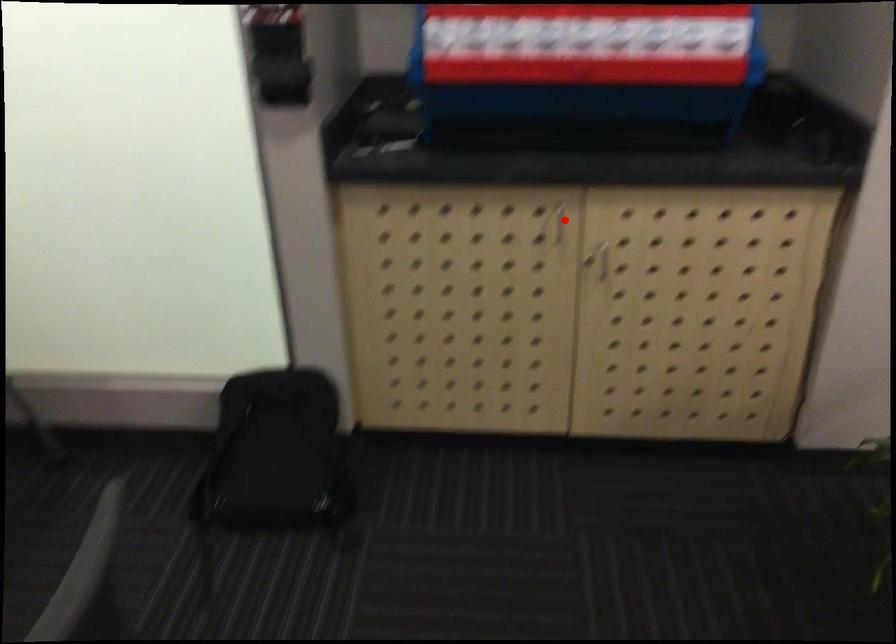
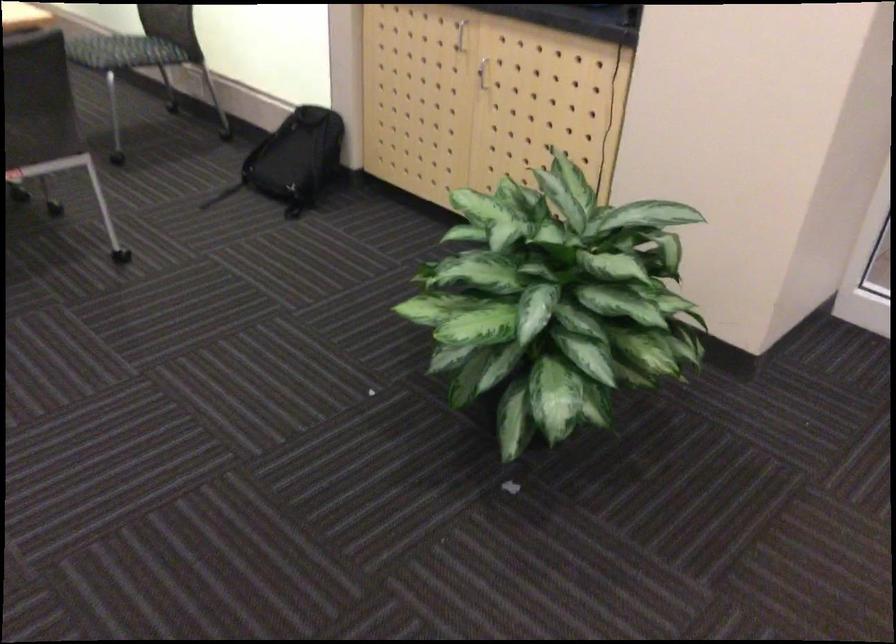
Find the pixel in the second image that matches the highlighted location in the first image.

(460, 35)